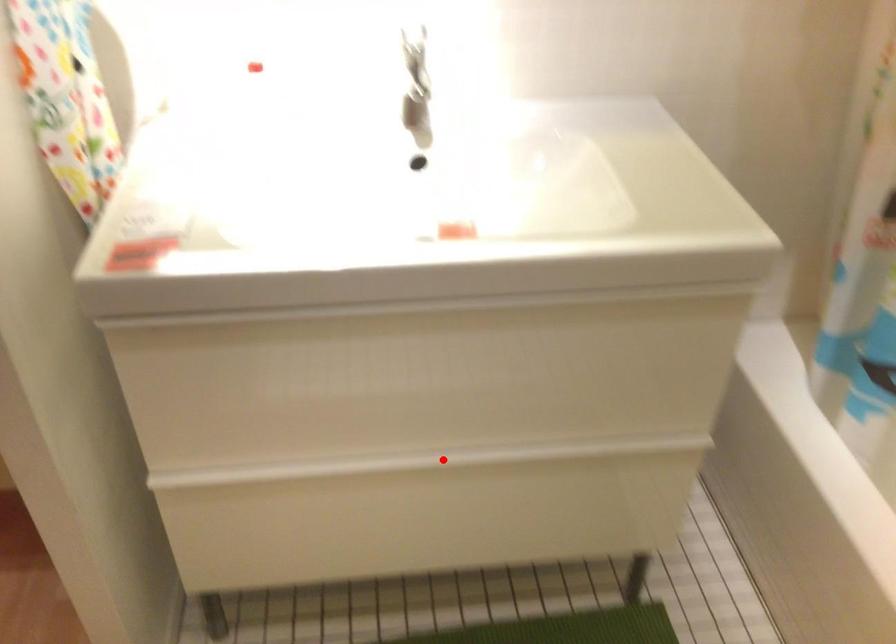
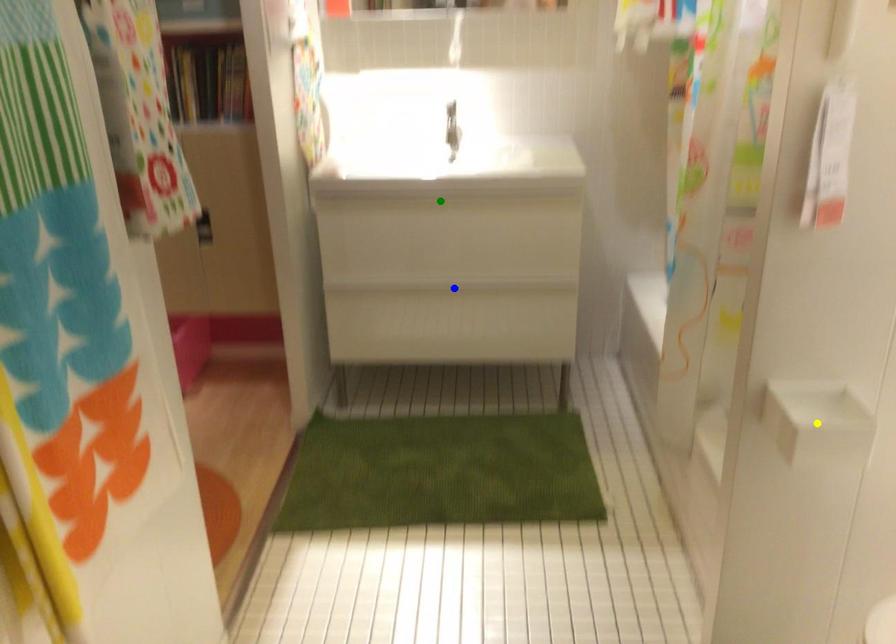
Question: I am providing you with two images of the same scene from different viewpoints. A red point is marked on the first image. You are given multiple points on the second image. Which spot in image 2 lines up with the point in image 1?

Choices:
 (A) yellow point
 (B) green point
 (C) blue point

Answer: (C)